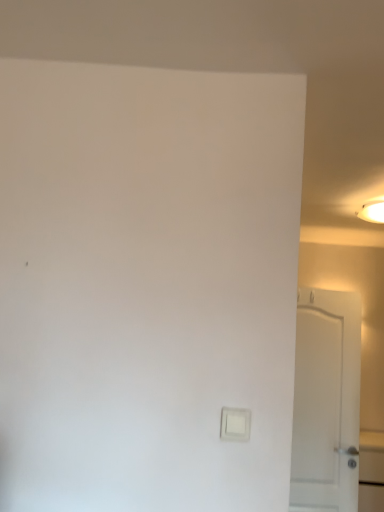
Question: From a real-world perspective, is white matte door at right beneath white plastic light switch at lower center?

Choices:
 (A) yes
 (B) no

Answer: (A)

Question: Is white matte door at right in contact with white plastic light switch at lower center?

Choices:
 (A) no
 (B) yes

Answer: (A)

Question: Is there a large distance between white matte door at right and white plastic light switch at lower center?

Choices:
 (A) yes
 (B) no

Answer: (A)

Question: Is white matte door at right oriented away from white plastic light switch at lower center?

Choices:
 (A) no
 (B) yes

Answer: (A)

Question: Is white matte door at right positioned in front of white plastic light switch at lower center?

Choices:
 (A) yes
 (B) no

Answer: (B)

Question: Based on their sizes in the image, would you say white matte door at right is bigger or smaller than white glossy light fixture at upper right?

Choices:
 (A) big
 (B) small

Answer: (A)

Question: Is point pos(302,360) positioned closer to the camera than point pos(367,219)?

Choices:
 (A) closer
 (B) farther

Answer: (A)

Question: In the image, is white matte door at right positioned in front of or behind white glossy light fixture at upper right?

Choices:
 (A) behind
 (B) front

Answer: (B)

Question: Choose the correct answer: Is white matte door at right inside white glossy light fixture at upper right or outside it?

Choices:
 (A) outside
 (B) inside

Answer: (A)

Question: From a real-world perspective, is white glossy light fixture at upper right above or below white plastic light switch at lower center?

Choices:
 (A) below
 (B) above

Answer: (B)

Question: Is white glossy light fixture at upper right in front of or behind white plastic light switch at lower center in the image?

Choices:
 (A) front
 (B) behind

Answer: (B)

Question: Is white glossy light fixture at upper right situated inside white plastic light switch at lower center or outside?

Choices:
 (A) outside
 (B) inside

Answer: (A)

Question: In terms of height, does white glossy light fixture at upper right look taller or shorter compared to white plastic light switch at lower center?

Choices:
 (A) tall
 (B) short

Answer: (A)

Question: Is point (221, 433) positioned closer to the camera than point (379, 222)?

Choices:
 (A) closer
 (B) farther

Answer: (A)

Question: From the image's perspective, is white plastic light switch at lower center above or below white glossy light fixture at upper right?

Choices:
 (A) above
 (B) below

Answer: (B)